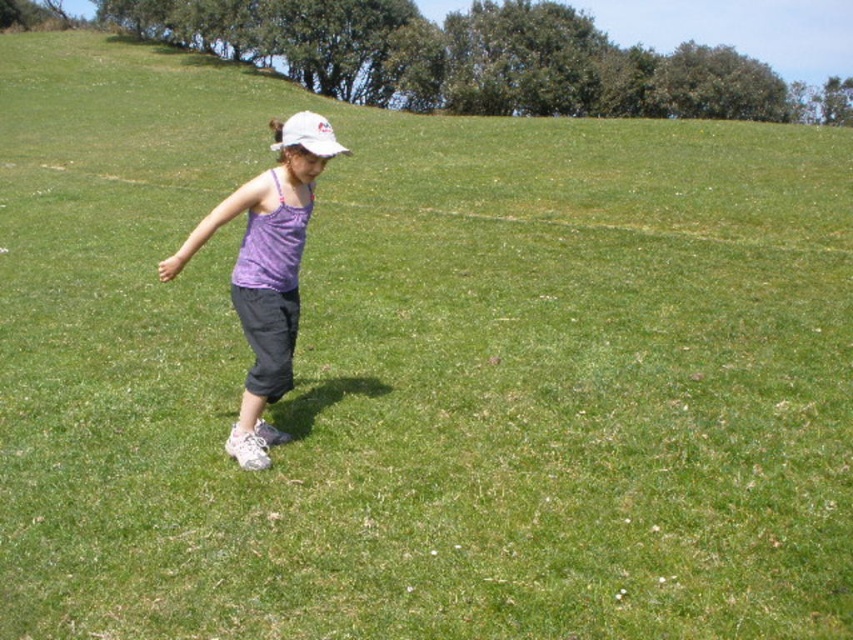
Question: Observing the image, what is the correct spatial positioning of purple fabric tank top at center in reference to white matte baseball hat at center?

Choices:
 (A) right
 (B) left

Answer: (A)

Question: Is purple fabric tank top at center wider than white matte baseball hat at center?

Choices:
 (A) no
 (B) yes

Answer: (A)

Question: Which point appears farthest from the camera in this image?

Choices:
 (A) (248, 444)
 (B) (344, 152)

Answer: (A)

Question: Does purple fabric tank top at center lie behind white matte baseball hat at center?

Choices:
 (A) yes
 (B) no

Answer: (B)